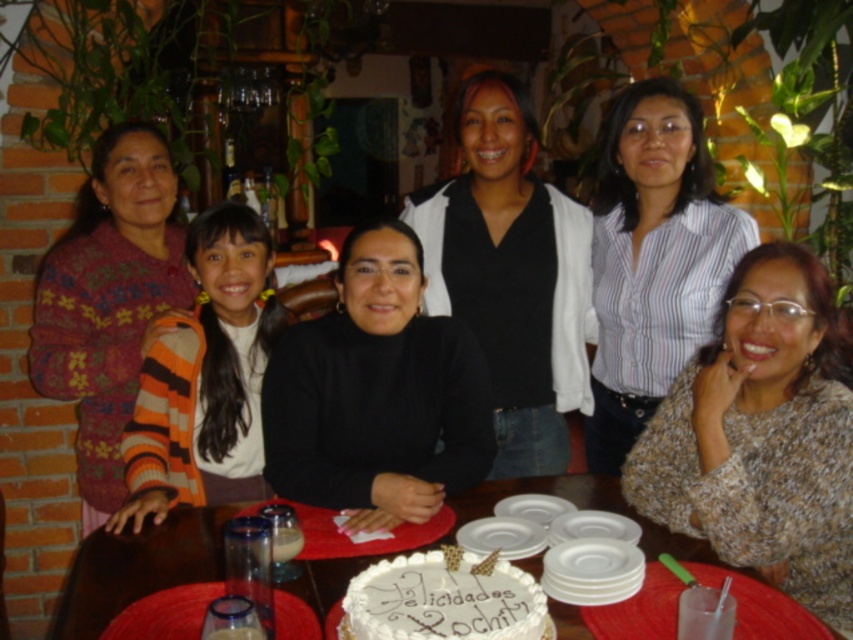
Question: Which of the following is the farthest from the observer?

Choices:
 (A) white striped shirt at center
 (B) knitted beige sweater at center
 (C) orange striped sweater at center
 (D) black matte vest at center

Answer: (A)

Question: Can you confirm if floral-patterned sweater at left is positioned above smooth wooden table at center?

Choices:
 (A) yes
 (B) no

Answer: (A)

Question: Which object is farther from the camera taking this photo?

Choices:
 (A) black matte vest at center
 (B) smooth wooden table at center

Answer: (A)

Question: Can you confirm if white striped shirt at center is positioned above floral-patterned sweater at left?

Choices:
 (A) no
 (B) yes

Answer: (B)

Question: Does knitted beige sweater at center appear over floral-patterned sweater at left?

Choices:
 (A) yes
 (B) no

Answer: (B)

Question: Which is nearer to the floral-patterned sweater at left?

Choices:
 (A) black matte vest at center
 (B) knitted beige sweater at center
 (C) orange striped sweater at center

Answer: (C)